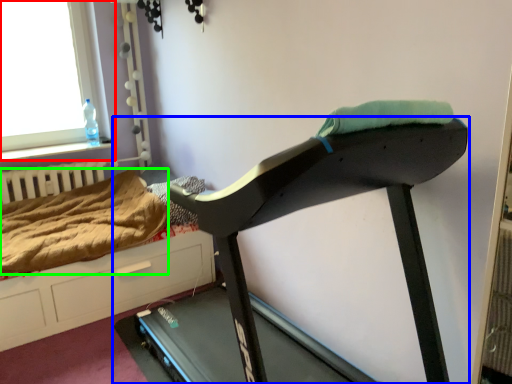
Question: Which object is positioned closest to window (highlighted by a red box)? Select from treadmill (highlighted by a blue box) and blanket (highlighted by a green box).

Choices:
 (A) treadmill
 (B) blanket

Answer: (B)